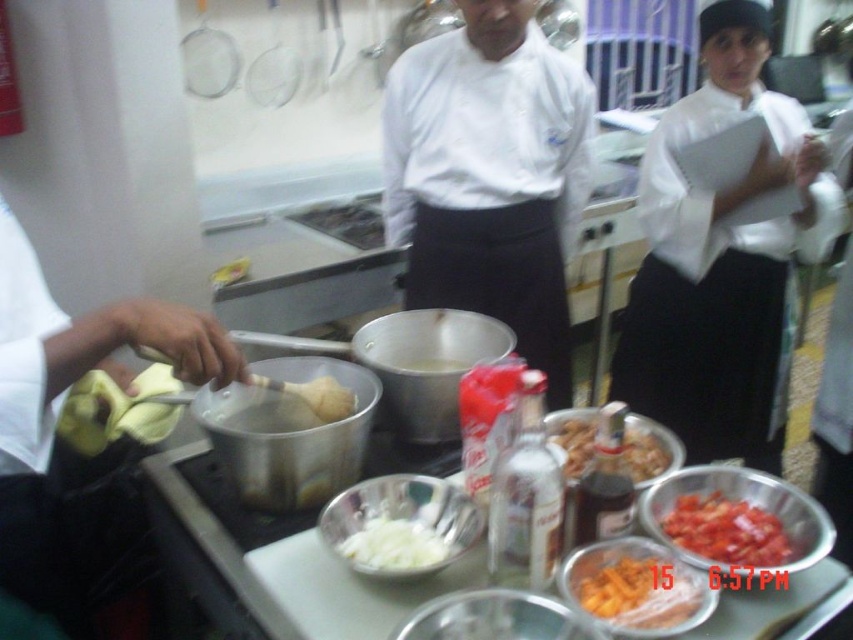
Can you confirm if chopped red pepper at center is positioned to the left of shiny metallic bowl at center?

No, chopped red pepper at center is not to the left of shiny metallic bowl at center.

The width and height of the screenshot is (853, 640). I want to click on chopped red pepper at center, so pyautogui.click(x=726, y=531).

Where is `chopped red pepper at center`? The height and width of the screenshot is (640, 853). chopped red pepper at center is located at coordinates (726, 531).

Who is higher up, chopped red pepper at center or white matte liquid at center?

white matte liquid at center

Which is more to the right, chopped red pepper at center or white matte liquid at center?

chopped red pepper at center is more to the right.

Does point (672, 531) come behind point (444, 369)?

No.

At what (x,y) coordinates should I click in order to perform the action: click on chopped red pepper at center. Please return your answer as a coordinate pair (x, y). Looking at the image, I should click on (726, 531).

Which is above, orange matte carrot at lower center or white creamy onions at center?

white creamy onions at center is above.

The image size is (853, 640). What do you see at coordinates (635, 589) in the screenshot?
I see `orange matte carrot at lower center` at bounding box center [635, 589].

Image resolution: width=853 pixels, height=640 pixels. Identify the location of orange matte carrot at lower center. (635, 589).